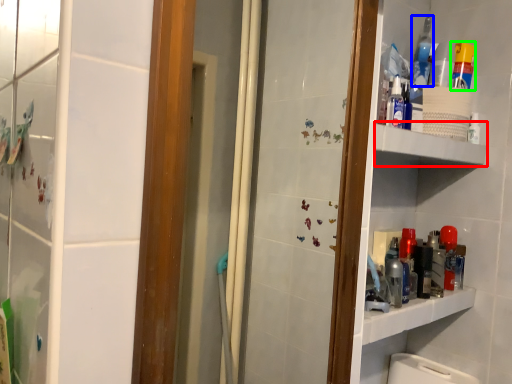
Question: Estimate the real-world distances between objects in this image. Which object is closer to shelve (highlighted by a red box), mouthwash (highlighted by a blue box) or cleaning product (highlighted by a green box)?

Choices:
 (A) mouthwash
 (B) cleaning product

Answer: (B)